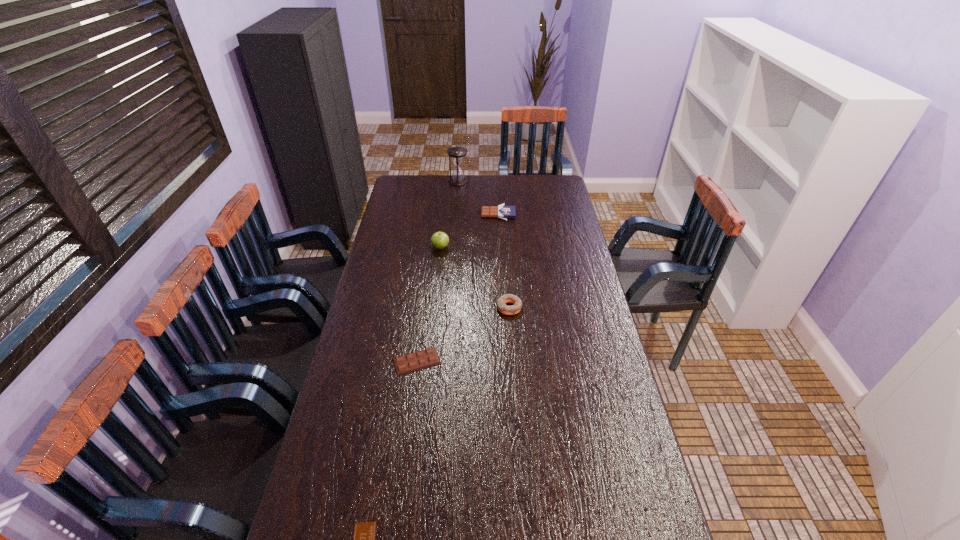
The height and width of the screenshot is (540, 960). Identify the location of hourglass. (457, 154).

The height and width of the screenshot is (540, 960). I want to click on the tallest object, so click(457, 154).

This screenshot has height=540, width=960. What are the coordinates of `the fourth nearest object` in the screenshot? It's located at (439, 240).

Locate an element on the screen. This screenshot has width=960, height=540. apple is located at coordinates (439, 240).

This screenshot has height=540, width=960. In order to click on doughnut in this screenshot , I will do `click(507, 298)`.

This screenshot has height=540, width=960. I want to click on the fourth shortest object, so click(507, 298).

Identify the location of the fourth tallest object. (503, 212).

Where is `the farthest chocolate bar`? The image size is (960, 540). the farthest chocolate bar is located at coordinates (503, 212).

The image size is (960, 540). I want to click on the second shortest chocolate bar, so click(422, 359).

Where is `the fifth farthest object`? the fifth farthest object is located at coordinates (422, 359).